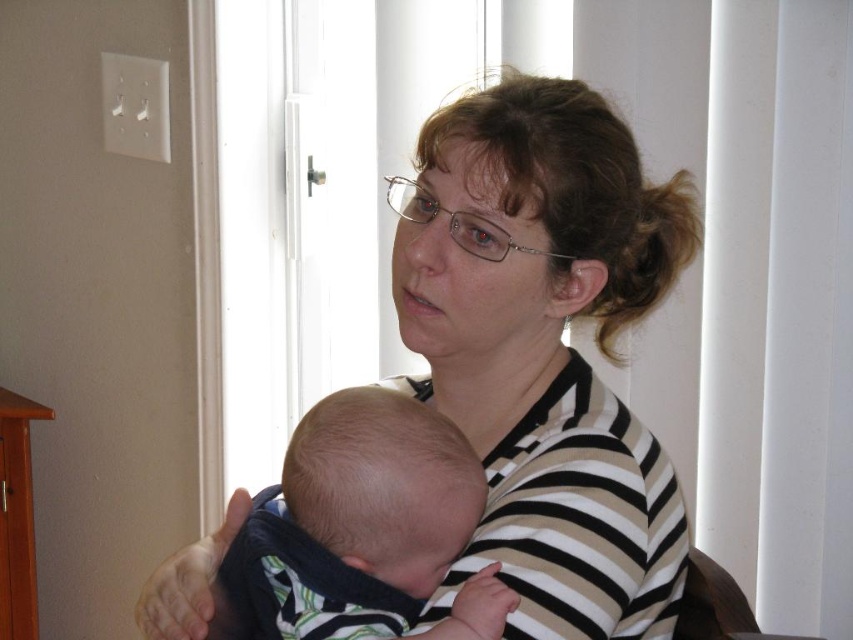
Question: Can you confirm if striped fabric woman at center is positioned to the right of soft white baby at center?

Choices:
 (A) no
 (B) yes

Answer: (B)

Question: Can you confirm if striped fabric woman at center is positioned below soft white baby at center?

Choices:
 (A) yes
 (B) no

Answer: (B)

Question: Which point is closer to the camera?

Choices:
 (A) striped fabric woman at center
 (B) soft white baby at center

Answer: (B)

Question: Is striped fabric woman at center smaller than soft white baby at center?

Choices:
 (A) yes
 (B) no

Answer: (B)